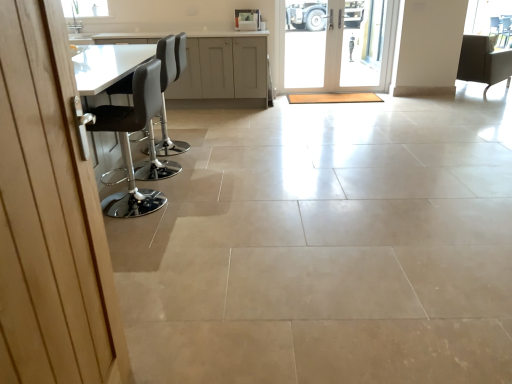
The width and height of the screenshot is (512, 384). What are the coordinates of `white leather bar stool at left, which appears as the second chair when viewed from the back` in the screenshot? It's located at (163, 121).

At what (x,y) coordinates should I click in order to perform the action: click on transparent glass window screen at upper right. Please return your answer as a coordinate pair (x, y). Looking at the image, I should click on (484, 14).

What do you see at coordinates (348, 53) in the screenshot?
I see `white glass door at center, which appears as the 1th door when viewed from the back` at bounding box center [348, 53].

In order to click on matte black chair at upper right, which is the 1th chair in back-to-front order in this screenshot , I will do `click(483, 62)`.

From the image's perspective, between white glass door at center, which appears as the 1th door when viewed from the back, and white leather bar stool at left, placed as the 1th chair when sorted from left to right, who is located below?

white leather bar stool at left, placed as the 1th chair when sorted from left to right, is shown below in the image.

How far apart are white glass door at center, the second door from the left, and white leather bar stool at left, acting as the 2th chair starting from the front?

They are 2.81 meters apart.

Does white glass door at center, the second door from the left, have a lesser width compared to white leather bar stool at left, which appears as the second chair when viewed from the back?

Yes, white glass door at center, the second door from the left, is thinner than white leather bar stool at left, which appears as the second chair when viewed from the back.

Based on the photo, who is bigger, white glass door at center, the first door in the top-to-bottom sequence, or white leather bar stool at left, placed as the 1th chair when sorted from left to right?

With larger size is white leather bar stool at left, placed as the 1th chair when sorted from left to right.

From the image's perspective, would you say matte gray cabinets at upper center is shown under white leather bar stool at left, which appears as the second chair when viewed from the back?

No, from the image's perspective, matte gray cabinets at upper center is not below white leather bar stool at left, which appears as the second chair when viewed from the back.

From a real-world perspective, relative to white leather bar stool at left, placed as the 1th chair when sorted from left to right, is matte gray cabinets at upper center vertically above or below?

From a real-world perspective, matte gray cabinets at upper center is physically below white leather bar stool at left, placed as the 1th chair when sorted from left to right.

Based on the photo, is matte gray cabinets at upper center shorter than white leather bar stool at left, placed as the 1th chair when sorted from left to right?

Yes.

Which is correct: matte gray cabinets at upper center is inside transparent glass window screen at upper right, or outside of it?

The correct answer is: outside.

Could you tell me if matte gray cabinets at upper center is facing transparent glass window screen at upper right?

No, matte gray cabinets at upper center is not aimed at transparent glass window screen at upper right.

Considering the relative sizes of matte gray cabinets at upper center and transparent glass window screen at upper right in the image provided, is matte gray cabinets at upper center thinner than transparent glass window screen at upper right?

In fact, matte gray cabinets at upper center might be wider than transparent glass window screen at upper right.

From a real-world perspective, is matte gray cabinets at upper center positioned above or below transparent glass window screen at upper right?

matte gray cabinets at upper center is below transparent glass window screen at upper right.

Is matte gray cabinets at upper center facing towards white glass door at center, which is the second door in bottom-to-top order?

No, matte gray cabinets at upper center is not oriented towards white glass door at center, which is the second door in bottom-to-top order.

Considering the sizes of objects matte gray cabinets at upper center and white glass door at center, the second door from the left, in the image provided, who is shorter, matte gray cabinets at upper center or white glass door at center, the second door from the left,?

With less height is matte gray cabinets at upper center.

Considering the sizes of objects matte gray cabinets at upper center and white glass door at center, the second door positioned from the front, in the image provided, who is smaller, matte gray cabinets at upper center or white glass door at center, the second door positioned from the front,?

white glass door at center, the second door positioned from the front, is smaller.

From the image's perspective, which is above, matte gray cabinets at upper center or white glass door at center, the first door in the top-to-bottom sequence?

white glass door at center, the first door in the top-to-bottom sequence.

Considering the relative sizes of wooden door at left, which is counted as the 2th door, starting from the back, and white glass door at center, the first door in the top-to-bottom sequence, in the image provided, is wooden door at left, which is counted as the 2th door, starting from the back, shorter than white glass door at center, the first door in the top-to-bottom sequence,?

Incorrect, the height of wooden door at left, which is counted as the 2th door, starting from the back, does not fall short of that of white glass door at center, the first door in the top-to-bottom sequence.

From a real-world perspective, is wooden door at left, positioned as the first door in front-to-back order, on top of white glass door at center, the first door in the top-to-bottom sequence?

Yes.

Is wooden door at left, acting as the first door starting from the bottom, to the left or to the right of white glass door at center, which is the first door from right to left, in the image?

Clearly, wooden door at left, acting as the first door starting from the bottom, is on the left of white glass door at center, which is the first door from right to left, in the image.

From the image's perspective, between wooden door at left, which is the first door in left-to-right order, and white glass door at center, the second door positioned from the front, who is located below?

wooden door at left, which is the first door in left-to-right order.

What are the coordinates of `the 1st chair to the right when counting from the matte gray cabinets at upper center` in the screenshot? It's located at (163, 121).

Does white leather bar stool at left, placed as the 1th chair when sorted from left to right, have a smaller size compared to matte gray cabinets at upper center?

Yes.

From a real-world perspective, which is physically below, white leather bar stool at left, acting as the 2th chair starting from the front, or matte gray cabinets at upper center?

matte gray cabinets at upper center.

How different are the orientations of white leather bar stool at left, the third chair positioned from the right, and matte gray cabinets at upper center in degrees?

The angular difference between white leather bar stool at left, the third chair positioned from the right, and matte gray cabinets at upper center is 88.1 degrees.

Which object is positioned more to the left, transparent glass window screen at upper right or matte gray cabinets at upper center?

matte gray cabinets at upper center is more to the left.

In the scene shown: Is transparent glass window screen at upper right oriented away from matte gray cabinets at upper center?

No, matte gray cabinets at upper center is not at the back of transparent glass window screen at upper right.

Is transparent glass window screen at upper right shorter than matte gray cabinets at upper center?

Yes.

There is a white glass door at center, the second door positioned from the front. In order to click on the 2nd chair below it (from the image's perspective) in this screenshot , I will do `click(163, 121)`.

You are a GUI agent. You are given a task and a screenshot of the screen. Output one action in this format:
    pyautogui.click(x=<x>, y=<y>)
    Task: Click on the cabinetry below the white leather bar stool at left, acting as the 2th chair starting from the front (from a real-world perspective)
    
    Given the screenshot: What is the action you would take?
    pyautogui.click(x=225, y=70)

Which object lies further to the anchor point white glass door at center, which is the first door from right to left, matte black chair at upper right, which is the 1th chair in back-to-front order, or black leather stool at left, the first chair when ordered from front to back?

black leather stool at left, the first chair when ordered from front to back.

Based on their spatial positions, is wooden door at left, which is the first door in left-to-right order, or black leather stool at left, the first chair when ordered from front to back, further from white glass door at center, the second door from the left?

Based on the image, wooden door at left, which is the first door in left-to-right order, appears to be further to white glass door at center, the second door from the left.

Considering their positions, is transparent glass window screen at upper right positioned further to white glass door at center, the second door positioned from the front, than wooden door at left, which is the first door in left-to-right order?

wooden door at left, which is the first door in left-to-right order, is positioned further to the anchor white glass door at center, the second door positioned from the front.

Estimate the real-world distances between objects in this image. Which object is further from transparent glass window screen at upper right, wooden door at left, acting as the first door starting from the bottom, or matte gray cabinets at upper center?

wooden door at left, acting as the first door starting from the bottom.

When comparing their distances from transparent glass window screen at upper right, does matte gray cabinets at upper center or black leather stool at left, which ranks as the 3th chair in back-to-front order, seem closer?

Based on the image, matte gray cabinets at upper center appears to be nearer to transparent glass window screen at upper right.

From the image, which object appears to be nearer to matte gray cabinets at upper center, white leather bar stool at left, acting as the 2th chair starting from the front, or white glass door at center, the second door positioned from the front?

Among the two, white glass door at center, the second door positioned from the front, is located nearer to matte gray cabinets at upper center.

When comparing their distances from transparent glass window screen at upper right, does white leather bar stool at left, placed as the 1th chair when sorted from left to right, or black leather stool at left, the first chair when ordered from front to back, seem closer?

white leather bar stool at left, placed as the 1th chair when sorted from left to right, is closer to transparent glass window screen at upper right.

Looking at this image, from the image, which object appears to be nearer to matte black chair at upper right, which is the 1th chair in right-to-left order, transparent glass window screen at upper right or matte gray cabinets at upper center?

The object closer to matte black chair at upper right, which is the 1th chair in right-to-left order, is transparent glass window screen at upper right.

In order to click on chair between white glass door at center, which is the second door in bottom-to-top order, and transparent glass window screen at upper right from left to right in this screenshot , I will do `click(483, 62)`.

Identify the location of cabinetry located between wooden door at left, which is counted as the 2th door, starting from the back, and matte black chair at upper right, the 3th chair in the left-to-right sequence, in the depth direction. (225, 70).

Locate an element on the screen. The height and width of the screenshot is (384, 512). door between wooden door at left, acting as the first door starting from the bottom, and transparent glass window screen at upper right from front to back is located at coordinates (348, 53).

The height and width of the screenshot is (384, 512). In order to click on cabinetry between wooden door at left, acting as the first door starting from the bottom, and white glass door at center, the second door positioned from the front, in the front-back direction in this screenshot , I will do `click(225, 70)`.